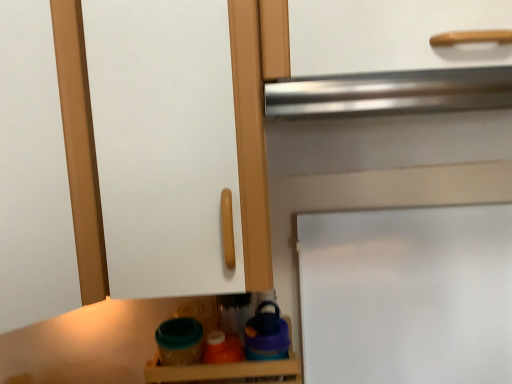
Question: Looking at the image, does translucent plastic containers at lower center seem bigger or smaller compared to white matte door at center?

Choices:
 (A) big
 (B) small

Answer: (B)

Question: Does point (271, 367) appear closer or farther from the camera than point (506, 322)?

Choices:
 (A) closer
 (B) farther

Answer: (A)

Question: From the image's perspective, is translucent plastic containers at lower center positioned above or below white matte door at center?

Choices:
 (A) below
 (B) above

Answer: (A)

Question: In terms of size, does white matte door at center appear bigger or smaller than translucent plastic containers at lower center?

Choices:
 (A) small
 (B) big

Answer: (B)

Question: In the image, is white matte door at center positioned in front of or behind translucent plastic containers at lower center?

Choices:
 (A) front
 (B) behind

Answer: (B)

Question: Considering the positions of white matte door at center and translucent plastic containers at lower center in the image, is white matte door at center wider or thinner than translucent plastic containers at lower center?

Choices:
 (A) thin
 (B) wide

Answer: (A)

Question: In the image, is white matte door at center on the left side or the right side of translucent plastic containers at lower center?

Choices:
 (A) right
 (B) left

Answer: (A)